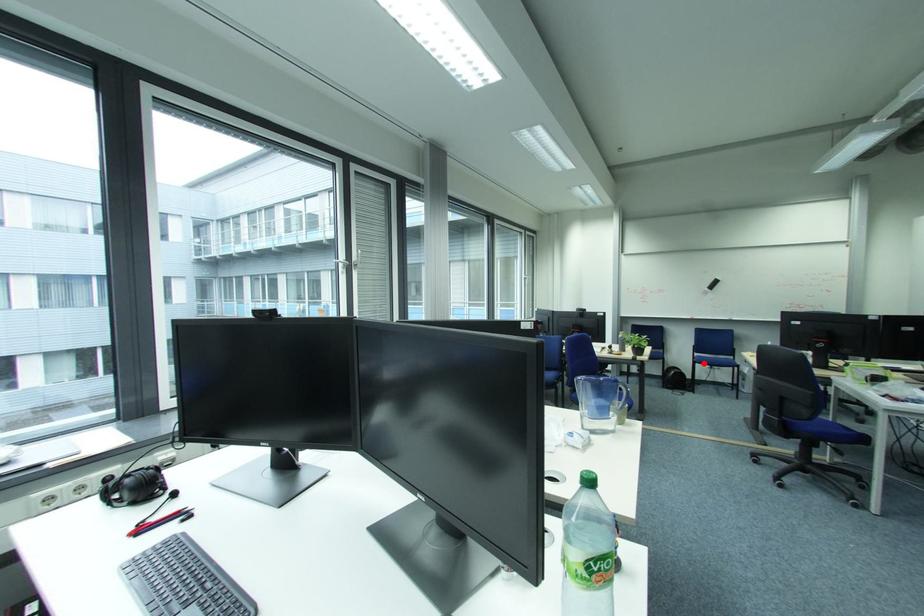
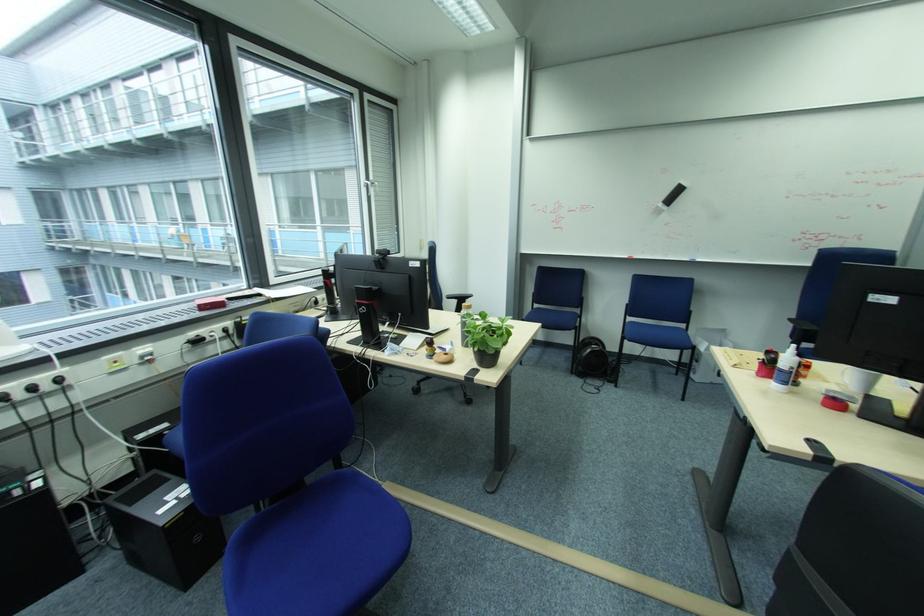
Question: I am providing you with two images of the same scene from different viewpoints. A red point is marked on the first image. Is the red point's position out of view in image 2?

Choices:
 (A) Yes
 (B) No

Answer: (B)